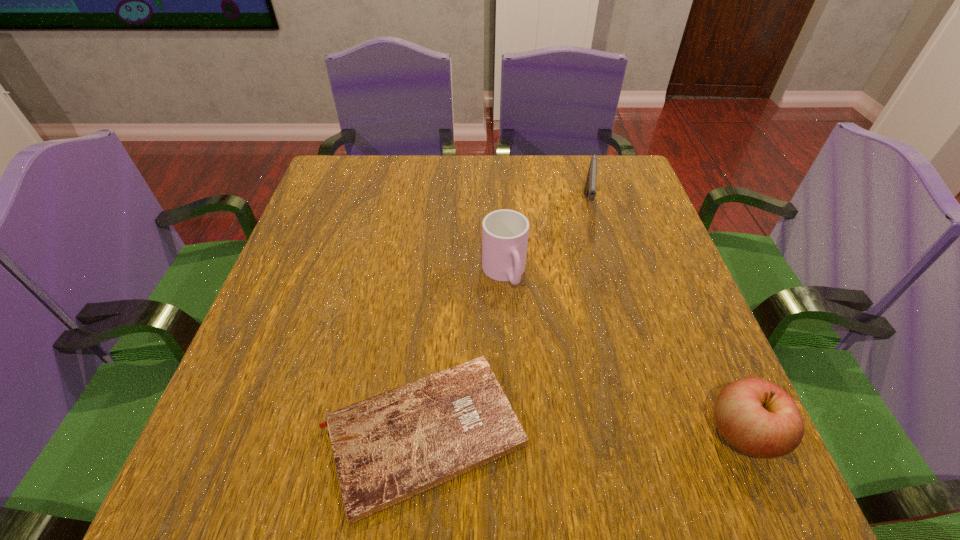
I want to click on Bible, so click(x=388, y=448).

Locate an element on the screen. apple is located at coordinates (757, 417).

Locate an element on the screen. Image resolution: width=960 pixels, height=540 pixels. cup is located at coordinates (505, 232).

Find the location of a particular element. The width and height of the screenshot is (960, 540). pistol is located at coordinates (590, 186).

Where is `the farthest object`? This screenshot has height=540, width=960. the farthest object is located at coordinates (590, 186).

Identify the location of free space located 0.070m on the right of the Bible. The height and width of the screenshot is (540, 960). (569, 433).

The height and width of the screenshot is (540, 960). I want to click on free space located on the left of the rightmost object, so (512, 433).

This screenshot has width=960, height=540. What are the coordinates of `vacant area situated with the handle on the side of the second farthest object` in the screenshot? It's located at click(x=564, y=421).

Locate an element on the screen. This screenshot has height=540, width=960. vacant space located 0.260m with the handle on the side of the second farthest object is located at coordinates (558, 405).

The height and width of the screenshot is (540, 960). Find the location of `free spot located with the handle on the side of the second farthest object`. free spot located with the handle on the side of the second farthest object is located at coordinates (532, 345).